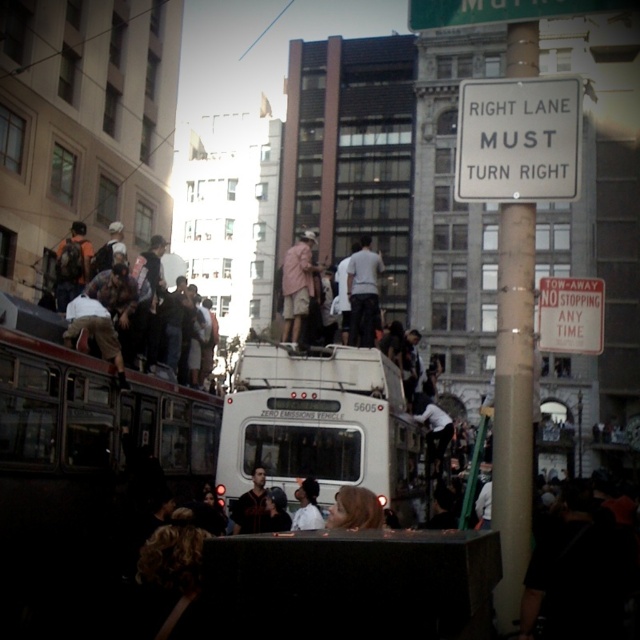
Is white matte pants at center taller than dark hair at center?

Correct, white matte pants at center is much taller as dark hair at center.

Which is in front, point (355, 307) or point (268, 522)?

Point (268, 522) is in front.

Find the location of a particular element. white matte pants at center is located at coordinates (364, 292).

Is white matte bus at center above matte black backpack at upper left?

No, white matte bus at center is not above matte black backpack at upper left.

Where is `white matte bus at center`? white matte bus at center is located at coordinates (321, 426).

Identify the location of white matte bus at center. The height and width of the screenshot is (640, 640). (321, 426).

Is white plastic sign at upper center above brown leather backpack at left?

Correct, white plastic sign at upper center is located above brown leather backpack at left.

Who is higher up, white plastic sign at upper center or brown leather backpack at left?

white plastic sign at upper center is higher up.

Image resolution: width=640 pixels, height=640 pixels. Find the location of `white plastic sign at upper center`. white plastic sign at upper center is located at coordinates [518, 140].

Where is `white plastic sign at upper center`? Image resolution: width=640 pixels, height=640 pixels. white plastic sign at upper center is located at coordinates (518, 140).